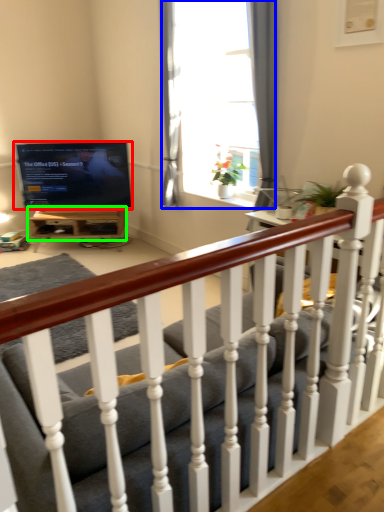
Question: Which object is positioned farthest from television (highlighted by a red box)? Select from window (highlighted by a blue box) and table (highlighted by a green box).

Choices:
 (A) window
 (B) table

Answer: (A)